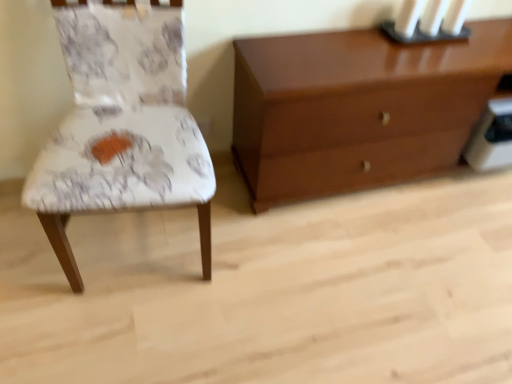
Question: Can you confirm if glossy wood chest of drawers at upper right is bigger than black matte candle holder at upper right?

Choices:
 (A) no
 (B) yes

Answer: (B)

Question: Is glossy wood chest of drawers at upper right taller than black matte candle holder at upper right?

Choices:
 (A) yes
 (B) no

Answer: (A)

Question: Is glossy wood chest of drawers at upper right not inside black matte candle holder at upper right?

Choices:
 (A) yes
 (B) no

Answer: (A)

Question: Considering the relative positions of glossy wood chest of drawers at upper right and black matte candle holder at upper right in the image provided, is glossy wood chest of drawers at upper right to the left of black matte candle holder at upper right from the viewer's perspective?

Choices:
 (A) yes
 (B) no

Answer: (A)

Question: Can you confirm if glossy wood chest of drawers at upper right is wider than black matte candle holder at upper right?

Choices:
 (A) no
 (B) yes

Answer: (B)

Question: Is point (459, 1) closer or farther from the camera than point (357, 51)?

Choices:
 (A) farther
 (B) closer

Answer: (A)

Question: Is black matte candle holder at upper right in front of or behind glossy wood chest of drawers at upper right in the image?

Choices:
 (A) front
 (B) behind

Answer: (B)

Question: In terms of height, does black matte candle holder at upper right look taller or shorter compared to glossy wood chest of drawers at upper right?

Choices:
 (A) short
 (B) tall

Answer: (A)

Question: Which is correct: black matte candle holder at upper right is inside glossy wood chest of drawers at upper right, or outside of it?

Choices:
 (A) inside
 (B) outside

Answer: (A)

Question: Looking at the image, does black matte candle holder at upper right seem bigger or smaller compared to white fabric chair at left?

Choices:
 (A) small
 (B) big

Answer: (A)

Question: From the image's perspective, relative to white fabric chair at left, is black matte candle holder at upper right above or below?

Choices:
 (A) below
 (B) above

Answer: (B)

Question: Is black matte candle holder at upper right to the left or to the right of white fabric chair at left in the image?

Choices:
 (A) right
 (B) left

Answer: (A)

Question: Looking at their shapes, would you say black matte candle holder at upper right is wider or thinner than white fabric chair at left?

Choices:
 (A) wide
 (B) thin

Answer: (B)

Question: Visually, is glossy wood chest of drawers at upper right positioned to the left or to the right of black matte candle holder at upper right?

Choices:
 (A) left
 (B) right

Answer: (A)

Question: From their relative heights in the image, would you say glossy wood chest of drawers at upper right is taller or shorter than black matte candle holder at upper right?

Choices:
 (A) short
 (B) tall

Answer: (B)